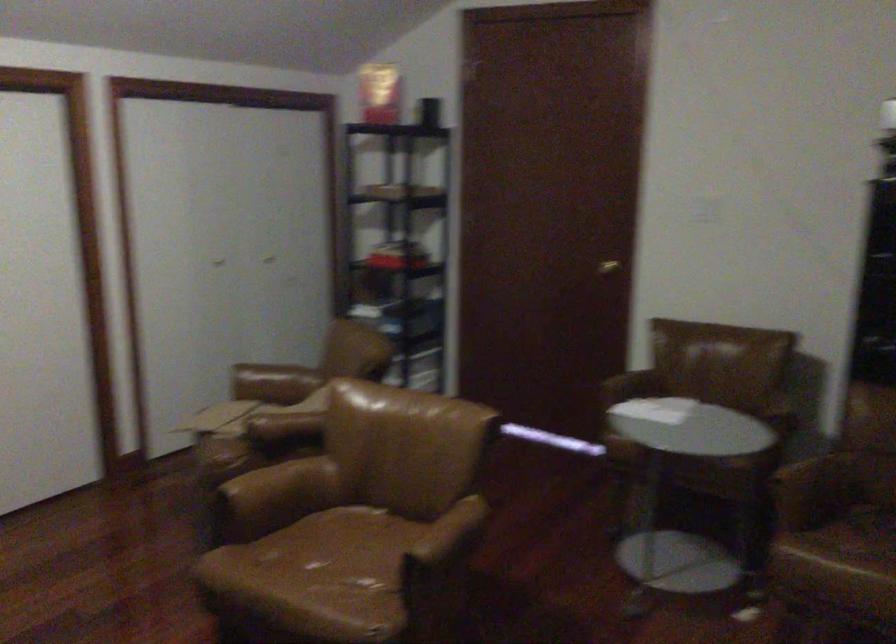
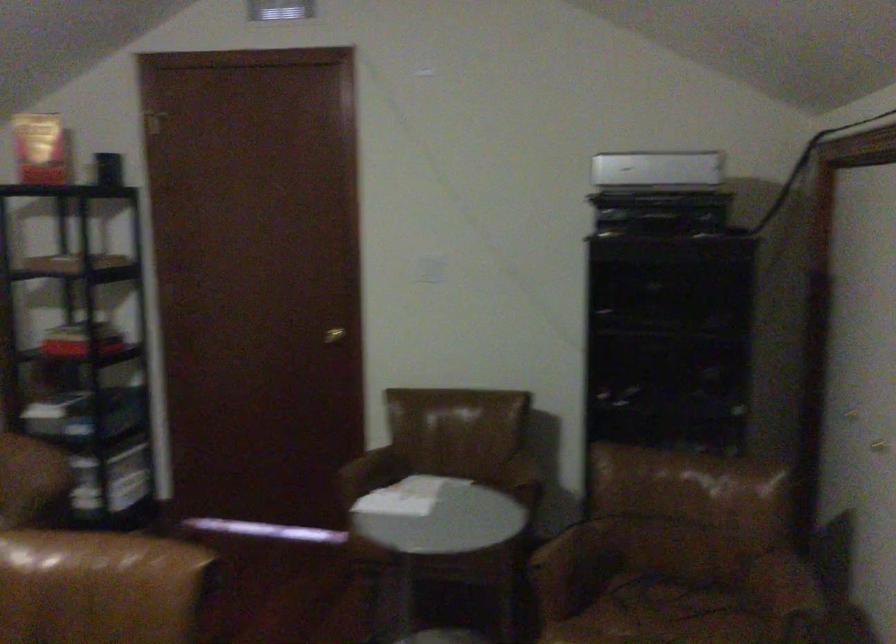
Question: Based on the continuous images, in which direction is the camera rotating? Reply with the corresponding letter.

Choices:
 (A) Left
 (B) Right
 (C) Up
 (D) Down

Answer: (B)